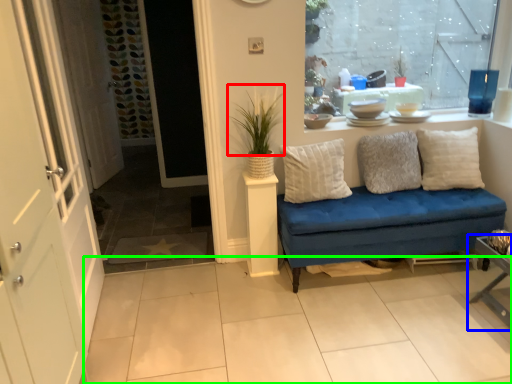
Question: Based on their relative distances, which object is farther from plant (highlighted by a red box)? Choose from table (highlighted by a blue box) and tile (highlighted by a green box).

Choices:
 (A) table
 (B) tile

Answer: (A)